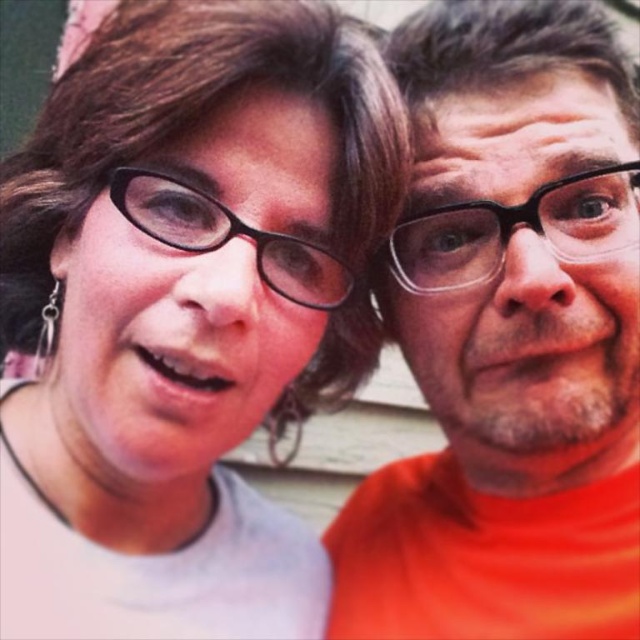
You are trying to decide which pair of glasses to wear based on their height. You have the clear plastic glasses at center and the black plastic glasses at center. Which pair is taller?

The clear plastic glasses at center is taller than the black plastic glasses at center.